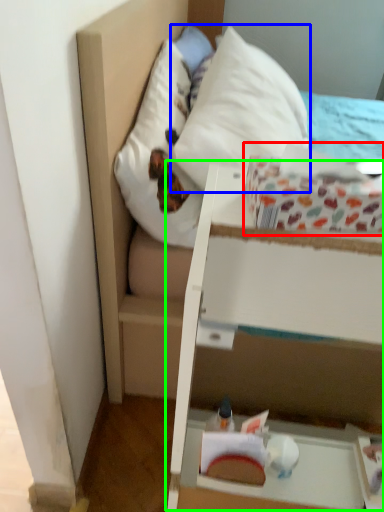
Question: Which object is the closest to the cardboard box (highlighted by a red box)? Choose among these: pillow (highlighted by a blue box) or vanity (highlighted by a green box).

Choices:
 (A) pillow
 (B) vanity

Answer: (B)